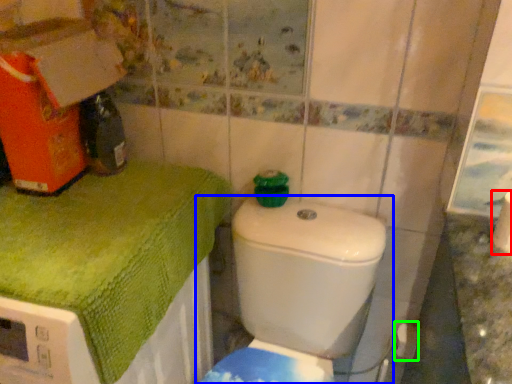
Question: Estimate the real-world distances between objects in this image. Which object is farther from toilet paper (highlighted by a red box), toilet (highlighted by a blue box) or toilet paper (highlighted by a green box)?

Choices:
 (A) toilet
 (B) toilet paper

Answer: (B)